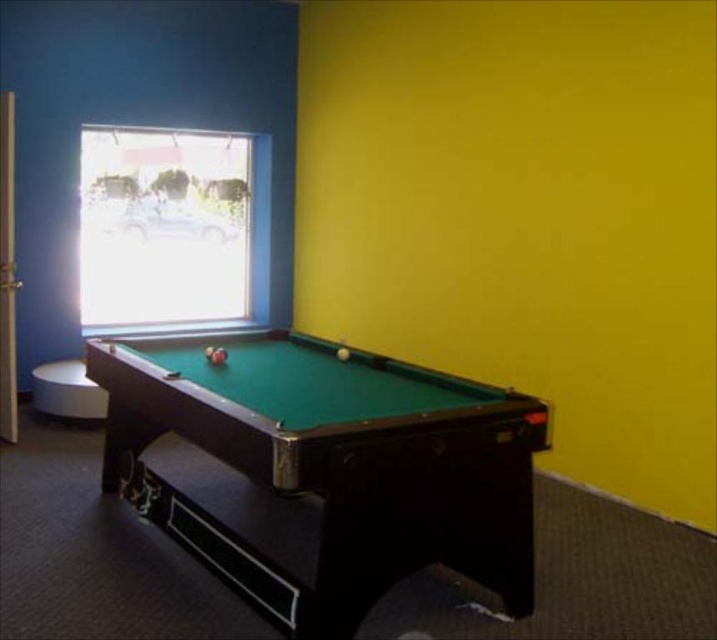
Question: Which of these objects is positioned farthest from the white matte stool at lower left?

Choices:
 (A) transparent glass window at upper left
 (B) green felt pool table at center

Answer: (B)

Question: Is transparent glass window at upper left thinner than white matte stool at lower left?

Choices:
 (A) no
 (B) yes

Answer: (A)

Question: Which of the following is the farthest from the observer?

Choices:
 (A) pos(489,548)
 (B) pos(161,248)

Answer: (B)

Question: Does green felt pool table at center have a lesser width compared to transparent glass window at upper left?

Choices:
 (A) yes
 (B) no

Answer: (B)

Question: In this image, where is transparent glass window at upper left located relative to white matte stool at lower left?

Choices:
 (A) above
 (B) below

Answer: (A)

Question: Estimate the real-world distances between objects in this image. Which object is farther from the green felt pool table at center?

Choices:
 (A) transparent glass window at upper left
 (B) white matte stool at lower left

Answer: (A)